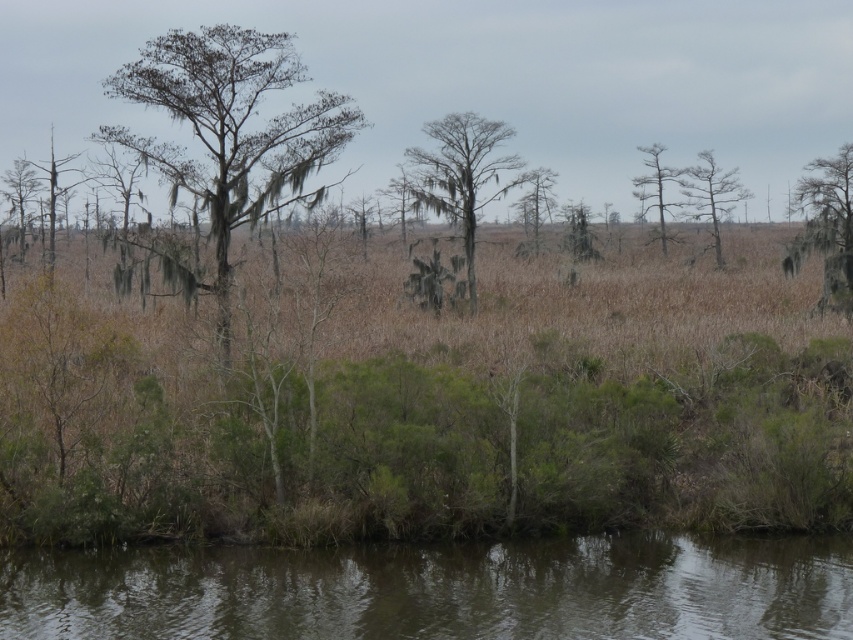
Looking at this image, you are standing in the wetland and want to take a photo of both the brown mossy tree at center and the smooth gray tree at upper right. Which tree should you focus on first to ensure both are in clear view?

You should focus on the brown mossy tree at center first because it is closer to you than the smooth gray tree at upper right, so adjusting focus from near to far will help both be in clear view.

You are a photographer standing at the edge of the wetland. You want to capture a photo where the brown murky water at lower center and the green mossy tree at left are both visible. Based on their heights, which object will appear closer to the bottom of the photo?

The brown murky water at lower center has a lesser height compared to the green mossy tree at left, so it will appear closer to the bottom of the photo.

You are an environmental scientist studying the wetland. You need to identify which tree has a larger trunk circumference between the smooth gray tree at upper right and the smooth bark tree at center. Which one should you measure first?

The smooth gray tree at upper right is bigger than the smooth bark tree at center, so you should measure the smooth gray tree at upper right first to determine its larger trunk circumference.